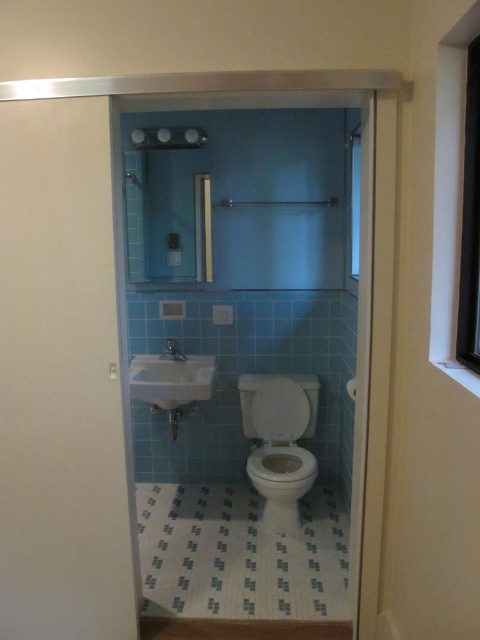
You are standing in the bathroom and want to reach the point at coordinates point (446,38). If your arm can extend 4 feet, can you touch it?

The distance between point (446,38) and the camera is 4.86 feet. Since your arm can only extend 4 feet, you cannot reach the point (446,38).

You are standing in the bathroom and need to open the window to let in some fresh air. Which direction should you move to reach the white wood window at upper right from the white glossy toilet at center?

The white wood window at upper right is to the right of the white glossy toilet at center, so you should move to your right to reach it.